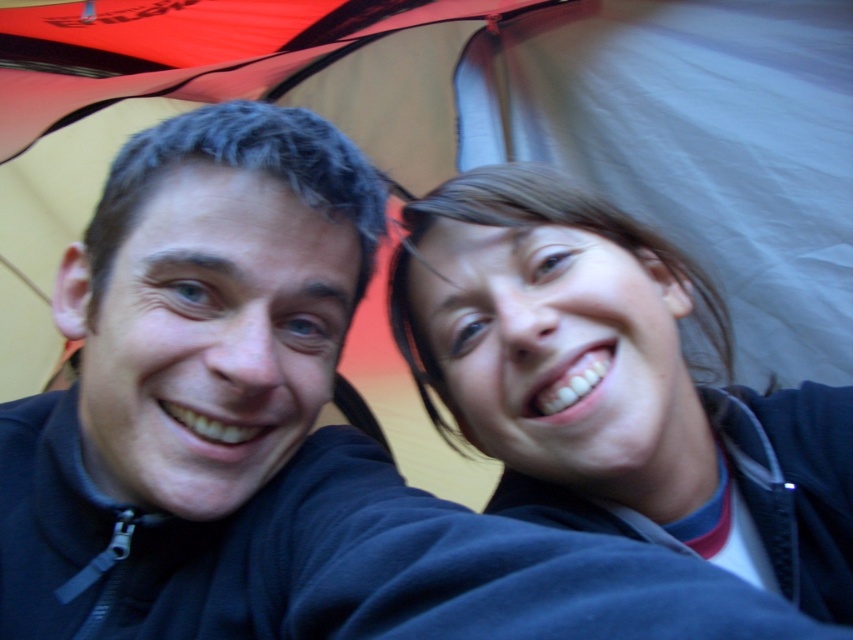
Between black matte jacket at left and smooth skin face at upper right, which one appears on the left side from the viewer's perspective?

black matte jacket at left

Is black matte jacket at left wider than smooth skin face at upper right?

Incorrect, black matte jacket at left's width does not surpass smooth skin face at upper right's.

I want to click on black matte jacket at left, so click(187, 352).